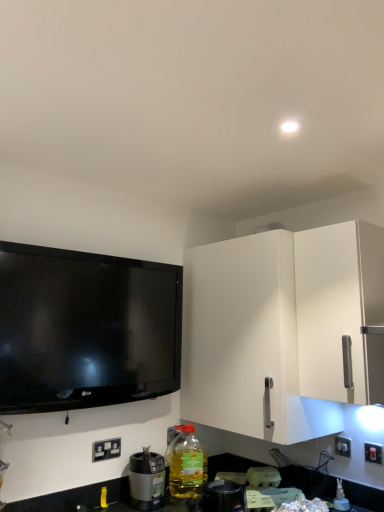
Question: Considering the relative sizes of white plastic electrical outlet at lower left, placed as the second electric outlet when sorted from right to left, and white matte cabinet at right in the image provided, is white plastic electrical outlet at lower left, placed as the second electric outlet when sorted from right to left, wider than white matte cabinet at right?

Choices:
 (A) no
 (B) yes

Answer: (A)

Question: Can you confirm if white plastic electrical outlet at lower left, placed as the second electric outlet when sorted from right to left, is bigger than white matte cabinet at right?

Choices:
 (A) no
 (B) yes

Answer: (A)

Question: From a real-world perspective, is white plastic electrical outlet at lower left, acting as the first electric outlet starting from the left, physically above white matte cabinet at right?

Choices:
 (A) no
 (B) yes

Answer: (A)

Question: Would you say white plastic electrical outlet at lower left, acting as the first electric outlet starting from the left, contains white matte cabinet at right?

Choices:
 (A) yes
 (B) no

Answer: (B)

Question: Considering the relative sizes of white plastic electrical outlet at lower left, acting as the first electric outlet starting from the left, and white matte cabinet at right in the image provided, is white plastic electrical outlet at lower left, acting as the first electric outlet starting from the left, taller than white matte cabinet at right?

Choices:
 (A) yes
 (B) no

Answer: (B)

Question: Would you say white matte cabinet at right is to the left or to the right of white plastic electrical outlet at lower left, placed as the second electric outlet when sorted from right to left, in the picture?

Choices:
 (A) left
 (B) right

Answer: (B)

Question: From the image's perspective, is white matte cabinet at right located above or below white plastic electrical outlet at lower left, placed as the second electric outlet when sorted from right to left?

Choices:
 (A) below
 (B) above

Answer: (B)

Question: Considering the positions of white matte cabinet at right and white plastic electrical outlet at lower left, placed as the second electric outlet when sorted from right to left, in the image, is white matte cabinet at right bigger or smaller than white plastic electrical outlet at lower left, placed as the second electric outlet when sorted from right to left,?

Choices:
 (A) big
 (B) small

Answer: (A)

Question: Considering their positions, is white matte cabinet at right located in front of or behind white plastic electrical outlet at lower left, placed as the second electric outlet when sorted from right to left?

Choices:
 (A) front
 (B) behind

Answer: (A)

Question: From the image's perspective, is white plastic electrical outlet at lower left, acting as the first electric outlet starting from the left, located above or below white plastic switch at lower right, the first electric outlet in the right-to-left sequence?

Choices:
 (A) above
 (B) below

Answer: (B)

Question: From a real-world perspective, is white plastic electrical outlet at lower left, placed as the second electric outlet when sorted from right to left, above or below white plastic switch at lower right, which is counted as the second electric outlet, starting from the left?

Choices:
 (A) below
 (B) above

Answer: (A)

Question: Is white plastic electrical outlet at lower left, acting as the first electric outlet starting from the left, taller or shorter than white plastic switch at lower right, which is counted as the second electric outlet, starting from the left?

Choices:
 (A) tall
 (B) short

Answer: (A)

Question: Relative to white plastic switch at lower right, which is counted as the second electric outlet, starting from the left, is white plastic electrical outlet at lower left, placed as the second electric outlet when sorted from right to left, in front or behind?

Choices:
 (A) front
 (B) behind

Answer: (B)

Question: Is metallic silver blender at lower center, the 2th appliance from the left, inside the boundaries of translucent plastic bottle at lower center, or outside?

Choices:
 (A) inside
 (B) outside

Answer: (B)

Question: From a real-world perspective, relative to translucent plastic bottle at lower center, is metallic silver blender at lower center, the 2th appliance when ordered from back to front, vertically above or below?

Choices:
 (A) above
 (B) below

Answer: (B)